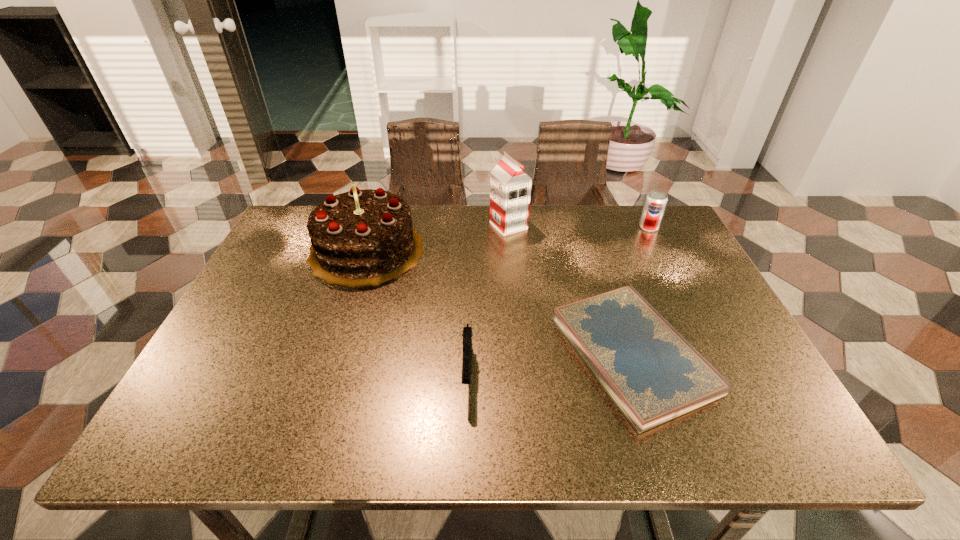
Identify the location of soya milk present at the far edge. This screenshot has height=540, width=960. [510, 187].

This screenshot has height=540, width=960. Find the location of `birthday cake that is at the far edge`. birthday cake that is at the far edge is located at coordinates (365, 237).

Locate an element on the screen. soda positioned at the far edge is located at coordinates (656, 201).

Where is `object present at the near edge`? The image size is (960, 540). object present at the near edge is located at coordinates click(x=652, y=373).

You are a GUI agent. You are given a task and a screenshot of the screen. Output one action in this format:
    pyautogui.click(x=<x>, y=<y>)
    Task: Click on the object situated at the left edge
    This screenshot has width=960, height=540.
    Given the screenshot: What is the action you would take?
    pyautogui.click(x=365, y=237)

Where is `soda at the right edge`? soda at the right edge is located at coordinates (656, 201).

The width and height of the screenshot is (960, 540). I want to click on paperback book present at the right edge, so click(652, 373).

At what (x,y) coordinates should I click in order to perform the action: click on object at the far left corner. Please return your answer as a coordinate pair (x, y). Looking at the image, I should click on (365, 237).

Find the location of a particular element. The width and height of the screenshot is (960, 540). object that is at the far right corner is located at coordinates (656, 201).

I want to click on object present at the near right corner, so click(x=652, y=373).